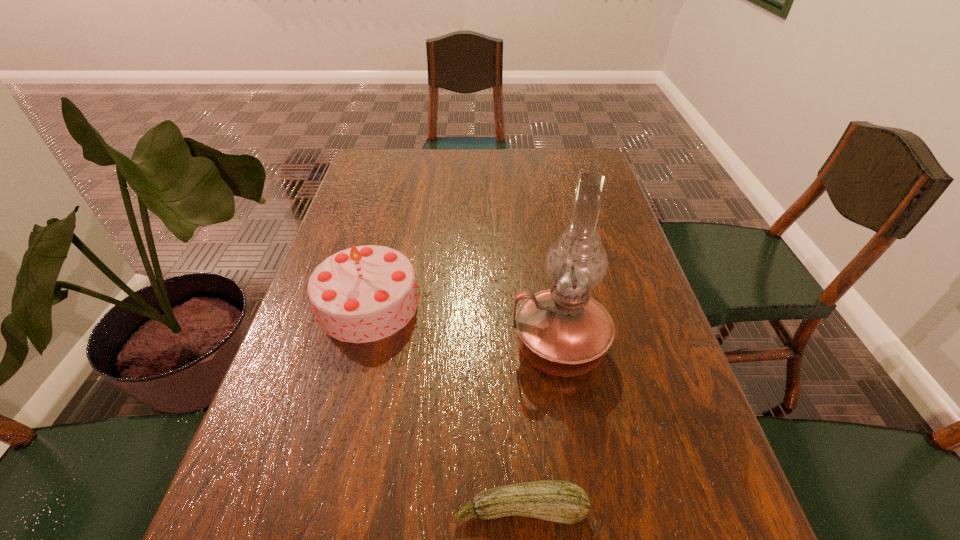
I want to click on the tallest object, so click(562, 331).

Identify the location of the second tallest object. The height and width of the screenshot is (540, 960). (362, 294).

Locate an element on the screen. This screenshot has height=540, width=960. birthday cake is located at coordinates (362, 294).

Image resolution: width=960 pixels, height=540 pixels. Find the location of `the shortest object`. the shortest object is located at coordinates (558, 501).

Identify the location of zucchini. (558, 501).

At what (x,y) coordinates should I click in order to perform the action: click on vacant space positioned on the right of the oil lamp. Please return your answer as a coordinate pair (x, y). This screenshot has height=540, width=960. Looking at the image, I should click on (635, 347).

Where is `free space located on the back of the birthday cake`? free space located on the back of the birthday cake is located at coordinates (392, 210).

I want to click on object that is positioned at the left edge, so click(x=362, y=294).

At what (x,y) coordinates should I click in order to perform the action: click on object located in the right edge section of the desktop. Please return your answer as a coordinate pair (x, y). The width and height of the screenshot is (960, 540). Looking at the image, I should click on (562, 331).

Find the location of a particular element. This screenshot has height=540, width=960. vacant space at the far edge is located at coordinates (484, 177).